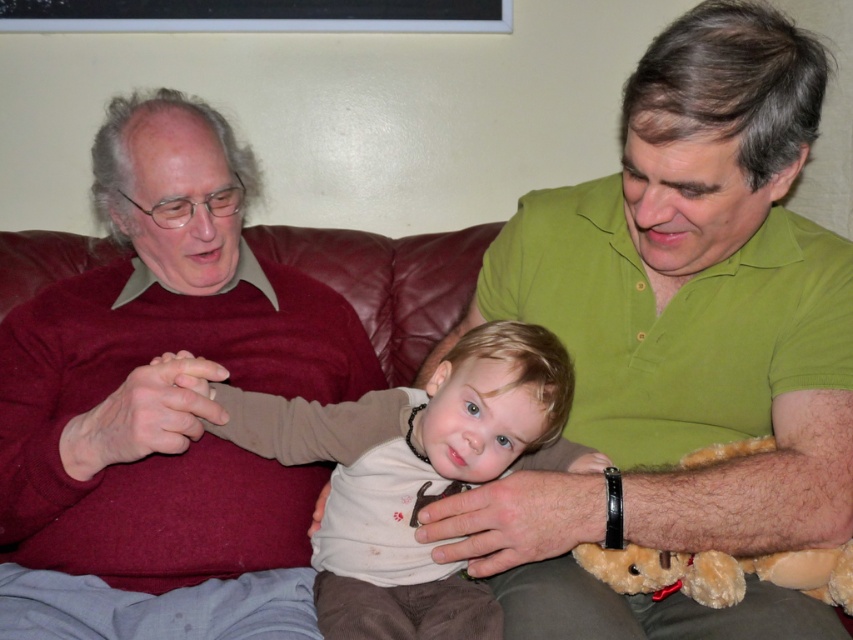
Which of these two, green matte shirt at center or light beige soft fabric shirt at center, stands shorter?

light beige soft fabric shirt at center is shorter.

Is green matte shirt at center wider than light beige soft fabric shirt at center?

Indeed, green matte shirt at center has a greater width compared to light beige soft fabric shirt at center.

Identify the location of green matte shirt at center. The height and width of the screenshot is (640, 853). (699, 291).

This screenshot has height=640, width=853. I want to click on green matte shirt at center, so click(699, 291).

Which is above, green matte shirt at center or brown plush teddy bear at lower right?

green matte shirt at center is above.

The height and width of the screenshot is (640, 853). What do you see at coordinates (699, 291) in the screenshot?
I see `green matte shirt at center` at bounding box center [699, 291].

The width and height of the screenshot is (853, 640). Identify the location of green matte shirt at center. (699, 291).

Which is in front, point (488, 609) or point (776, 576)?

Point (776, 576) is more forward.

Does light beige soft fabric shirt at center appear on the right side of brown plush teddy bear at lower right?

No, light beige soft fabric shirt at center is not to the right of brown plush teddy bear at lower right.

Which is in front, point (503, 323) or point (718, 563)?

Point (718, 563) is in front.

This screenshot has height=640, width=853. I want to click on light beige soft fabric shirt at center, so click(x=415, y=476).